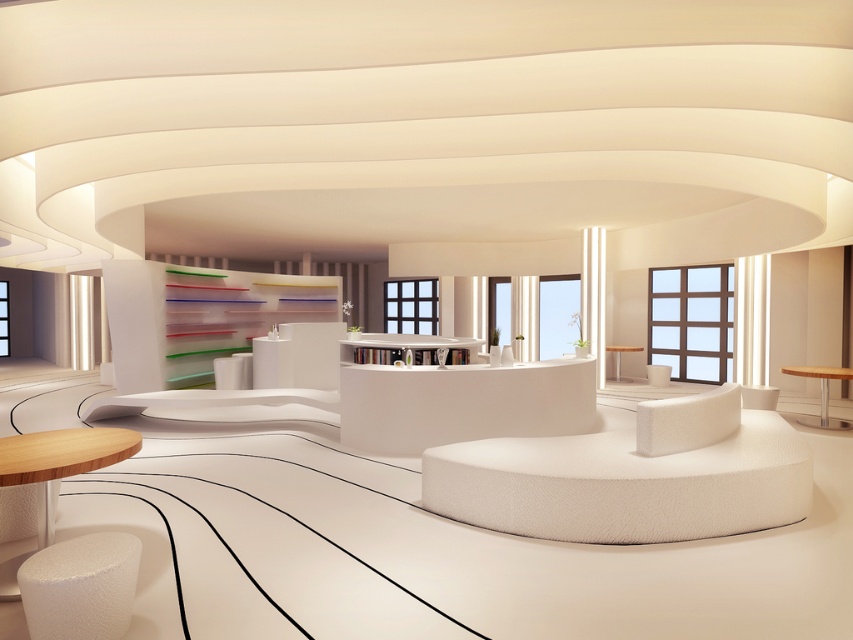
Please provide the coordinates of the satin white stool at lower left in the image.

The satin white stool at lower left is located at point (x=80, y=586).